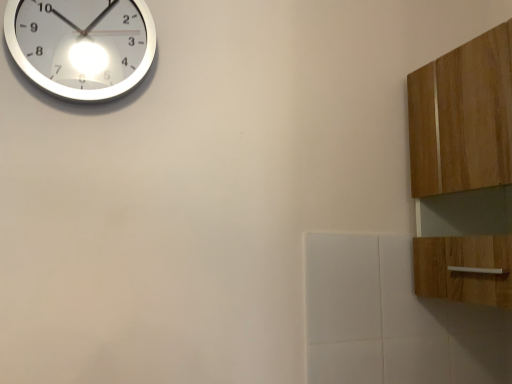
Locate an element on the screen. The width and height of the screenshot is (512, 384). silver metallic clock at upper left is located at coordinates (81, 45).

What do you see at coordinates (81, 45) in the screenshot? I see `silver metallic clock at upper left` at bounding box center [81, 45].

The width and height of the screenshot is (512, 384). I want to click on silver metallic clock at upper left, so click(81, 45).